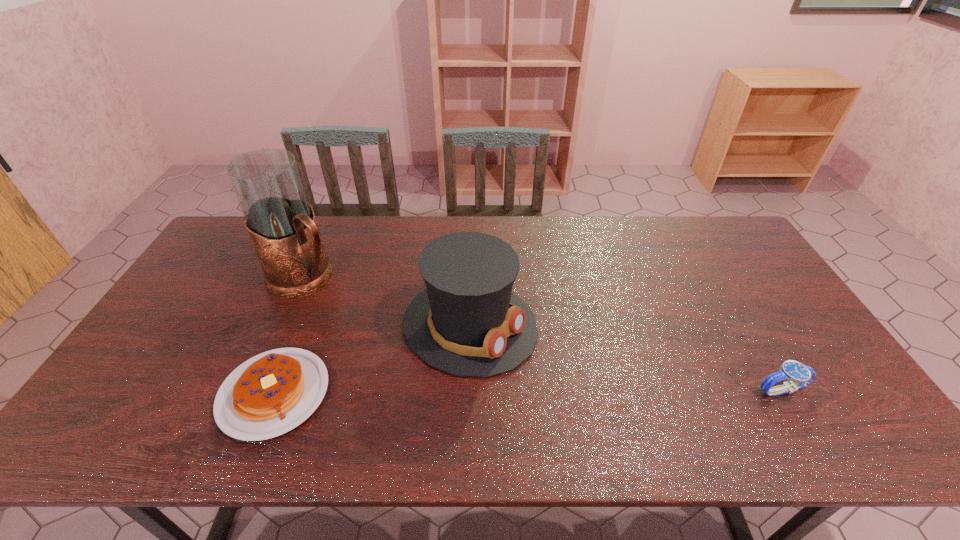
Find the location of `vacant space on the desktop that is between the pancake and the third tallest object and is positioned with the handle on the side of the pitcher`. vacant space on the desktop that is between the pancake and the third tallest object and is positioned with the handle on the side of the pitcher is located at coordinates (473, 393).

Find the location of `free spot on the desktop that is between the shortest object and the rightmost object and is positioned with goggles on the front of the dress hat`. free spot on the desktop that is between the shortest object and the rightmost object and is positioned with goggles on the front of the dress hat is located at coordinates (597, 392).